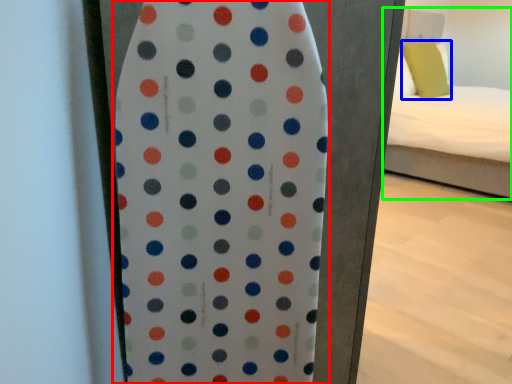
Question: Based on their relative distances, which object is nearer to surfboard (highlighted by a red box)? Choose from pillow (highlighted by a blue box) and bed (highlighted by a green box).

Choices:
 (A) pillow
 (B) bed

Answer: (B)